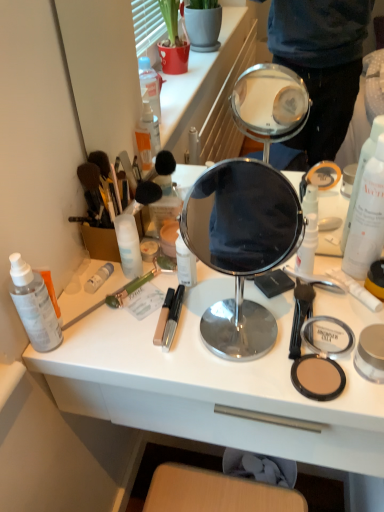
Where is `vacant space that is in between matte black compact at lower right and translucent plastic spray bottle at left, which is the 2th toiletry in left-to-right order`? vacant space that is in between matte black compact at lower right and translucent plastic spray bottle at left, which is the 2th toiletry in left-to-right order is located at coordinates (192, 356).